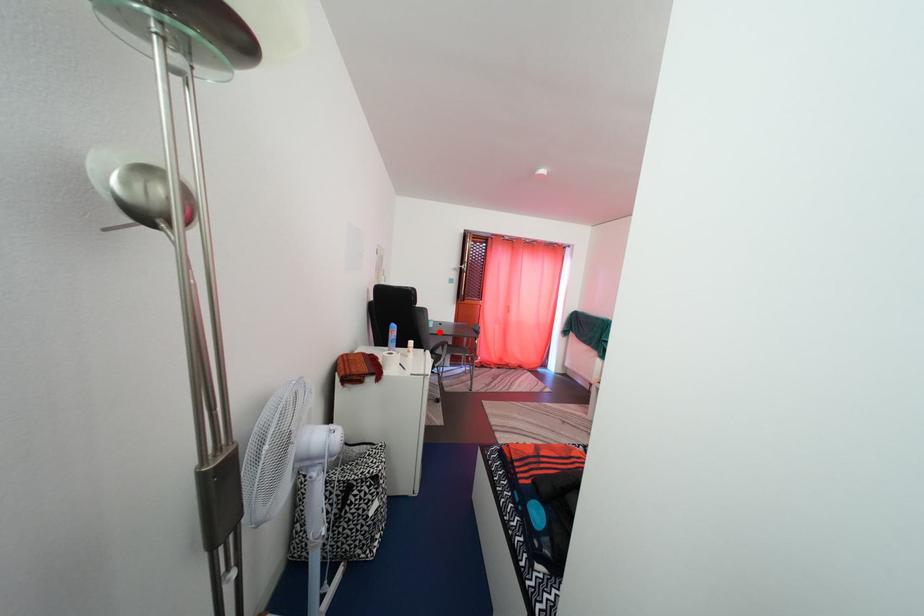
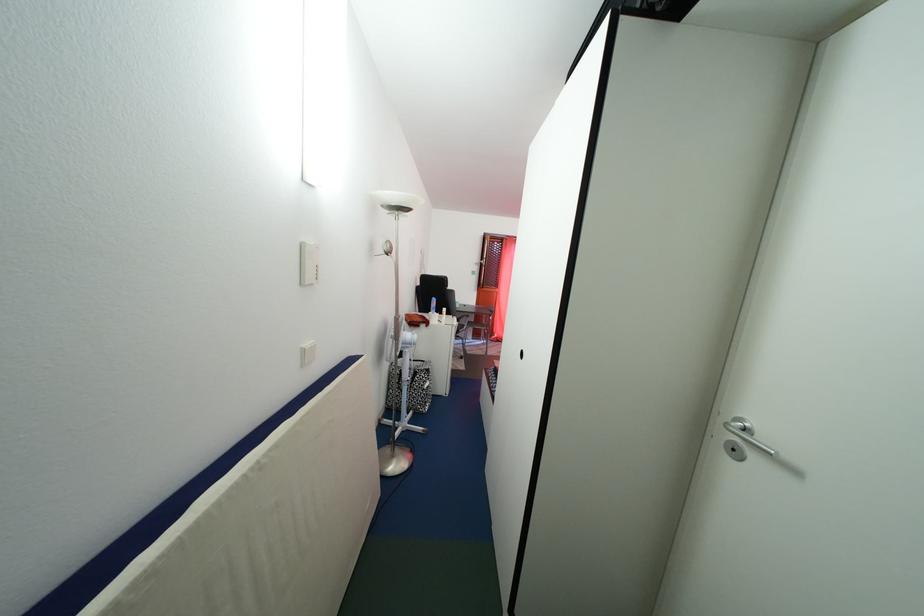
Find the pixel in the second image that matches the highlighted location in the first image.

(466, 313)